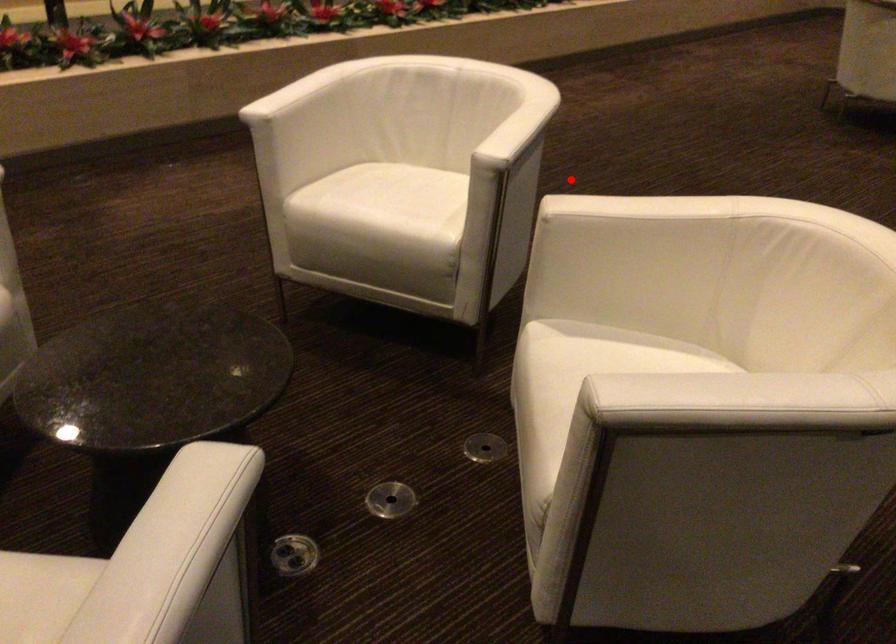
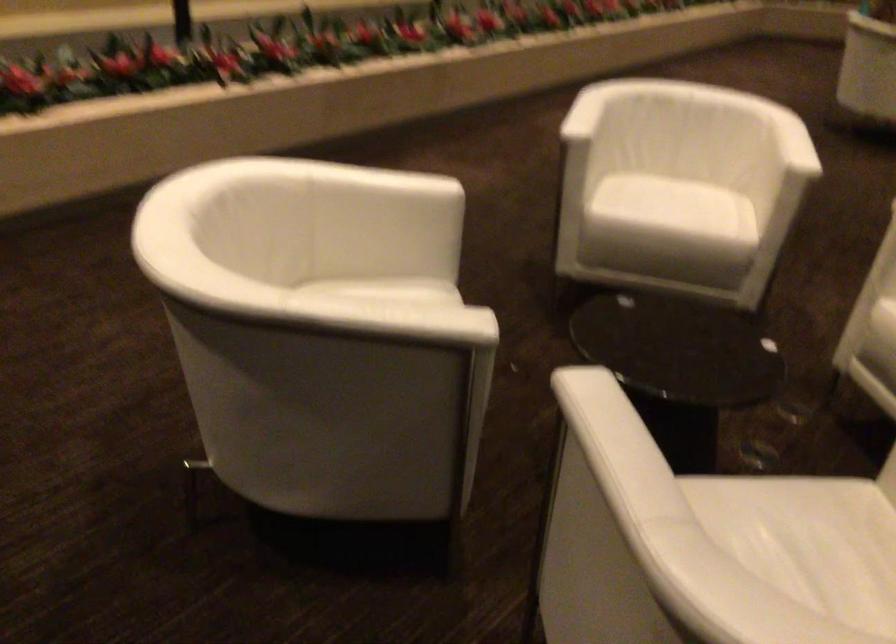
Question: I am providing you with two images of the same scene from different viewpoints. A red point is marked on the first image. Is the red point's position out of view in image 2?

Choices:
 (A) Yes
 (B) No

Answer: (A)